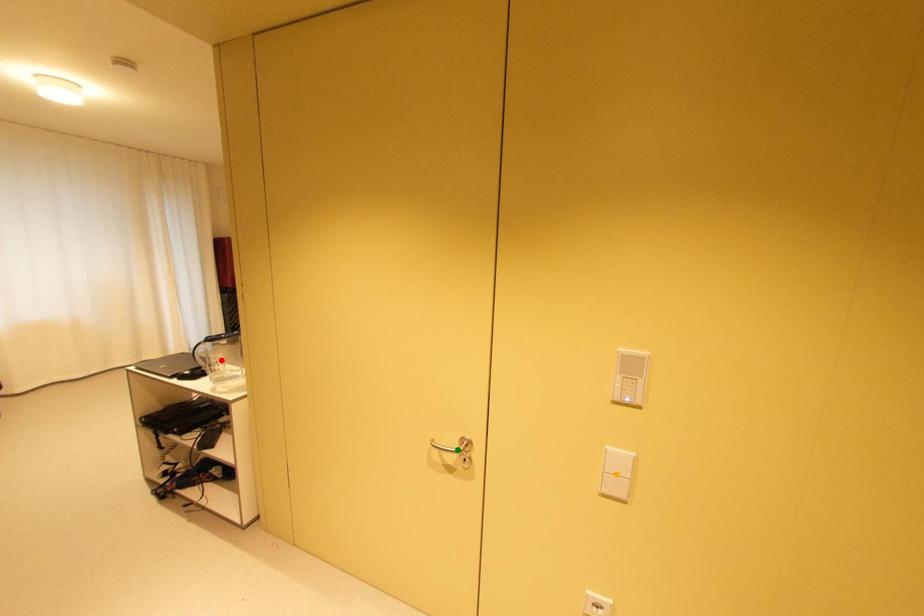
Order these from farthest to nearest:
- orange point
- green point
- red point

red point → green point → orange point